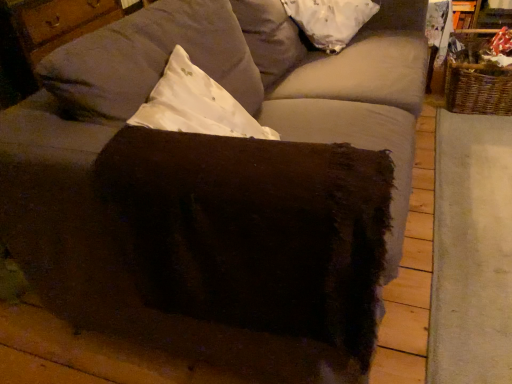
At what (x,y) coordinates should I click in order to perform the action: click on woven brown basket at right. Please return your answer as a coordinate pair (x, y). The height and width of the screenshot is (384, 512). Looking at the image, I should click on (476, 78).

Find the location of a particular element. This screenshot has height=384, width=512. brown fuzzy ottoman at center is located at coordinates [x=253, y=231].

Locate an element on the screen. Image resolution: width=512 pixels, height=384 pixels. woven brown basket at right is located at coordinates (476, 78).

Which object is wider, white fabric pillow at upper center or brown fuzzy ottoman at center?

With larger width is brown fuzzy ottoman at center.

This screenshot has width=512, height=384. I want to click on swivel chair in front of the white fabric pillow at upper center, so click(x=253, y=231).

Is white fabric pillow at upper center facing towards brown fuzzy ottoman at center?

No.

Is brown fuzzy ottoman at center wider or thinner than woven brown basket at right?

In the image, brown fuzzy ottoman at center appears to be wider than woven brown basket at right.

This screenshot has height=384, width=512. Identify the location of basket positioned vertically above the brown fuzzy ottoman at center (from a real-world perspective). (476, 78).

Is point (267, 268) farther from camera compared to point (455, 55)?

That is False.

Considering the sizes of objects brown fuzzy ottoman at center and woven brown basket at right in the image provided, who is bigger, brown fuzzy ottoman at center or woven brown basket at right?

With larger size is brown fuzzy ottoman at center.

Is white fabric pillow at upper center shorter than woven brown basket at right?

Yes.

Image resolution: width=512 pixels, height=384 pixels. In order to click on pillow on the left of the woven brown basket at right in this screenshot , I will do pyautogui.click(x=330, y=20).

Would you say white fabric pillow at upper center is to the left or to the right of woven brown basket at right in the picture?

Clearly, white fabric pillow at upper center is on the left of woven brown basket at right in the image.

Based on their sizes in the image, would you say white fabric pillow at upper center is bigger or smaller than woven brown basket at right?

Considering their sizes, white fabric pillow at upper center takes up less space than woven brown basket at right.

Find the location of a particular element. basket below the white fabric pillow at upper center (from the image's perspective) is located at coordinates (476, 78).

Looking at their sizes, would you say woven brown basket at right is wider or thinner than white fabric pillow at upper center?

Clearly, woven brown basket at right has more width compared to white fabric pillow at upper center.

Which object is more forward, woven brown basket at right or white fabric pillow at upper center?

white fabric pillow at upper center is more forward.

Are woven brown basket at right and white fabric pillow at upper center making contact?

No, woven brown basket at right is not with white fabric pillow at upper center.

Is woven brown basket at right facing away from brown fuzzy ottoman at center?

That's not correct — woven brown basket at right is not looking away from brown fuzzy ottoman at center.

Between point (467, 64) and point (241, 249), which one is positioned in front?

The point (241, 249) is in front.

Measure the distance between woven brown basket at right and brown fuzzy ottoman at center.

woven brown basket at right is 5.69 feet away from brown fuzzy ottoman at center.

Considering the relative sizes of woven brown basket at right and brown fuzzy ottoman at center in the image provided, is woven brown basket at right taller than brown fuzzy ottoman at center?

Correct, woven brown basket at right is much taller as brown fuzzy ottoman at center.

Can we say brown fuzzy ottoman at center lies outside white fabric pillow at upper center?

Yes, brown fuzzy ottoman at center is located beyond the bounds of white fabric pillow at upper center.

Considering the sizes of objects brown fuzzy ottoman at center and white fabric pillow at upper center in the image provided, who is taller, brown fuzzy ottoman at center or white fabric pillow at upper center?

white fabric pillow at upper center is taller.

From a real-world perspective, is brown fuzzy ottoman at center physically located above or below white fabric pillow at upper center?

In terms of real-world spatial position, brown fuzzy ottoman at center is below white fabric pillow at upper center.

Does point (275, 206) come behind point (292, 18)?

No, it is in front of (292, 18).

You are a GUI agent. You are given a task and a screenshot of the screen. Output one action in this format:
    pyautogui.click(x=<x>, y=<y>)
    Task: Click on the pillow on the right of brown fuzzy ottoman at center
    
    Given the screenshot: What is the action you would take?
    pyautogui.click(x=330, y=20)

Locate an element on the screen. This screenshot has width=512, height=384. swivel chair on the left of the woven brown basket at right is located at coordinates (253, 231).

From the image, which object appears to be nearer to white fabric pillow at upper center, woven brown basket at right or brown fuzzy ottoman at center?

woven brown basket at right is positioned closer to the anchor white fabric pillow at upper center.

From the image, which object appears to be farther from woven brown basket at right, white fabric pillow at upper center or brown fuzzy ottoman at center?

The object further to woven brown basket at right is brown fuzzy ottoman at center.

Which object lies nearer to the anchor point white fabric pillow at upper center, brown fuzzy ottoman at center or woven brown basket at right?

Based on the image, woven brown basket at right appears to be nearer to white fabric pillow at upper center.

Looking at the image, which one is located further to woven brown basket at right, brown fuzzy ottoman at center or white fabric pillow at upper center?

brown fuzzy ottoman at center is positioned further to the anchor woven brown basket at right.

Considering their positions, is white fabric pillow at upper center positioned further to brown fuzzy ottoman at center than woven brown basket at right?

woven brown basket at right is positioned further to the anchor brown fuzzy ottoman at center.

Looking at this image, looking at the image, which one is located further to brown fuzzy ottoman at center, woven brown basket at right or white fabric pillow at upper center?

Among the two, woven brown basket at right is located further to brown fuzzy ottoman at center.

The image size is (512, 384). Find the location of `pillow between brown fuzzy ottoman at center and woven brown basket at right in the front-back direction`. pillow between brown fuzzy ottoman at center and woven brown basket at right in the front-back direction is located at coordinates (330, 20).